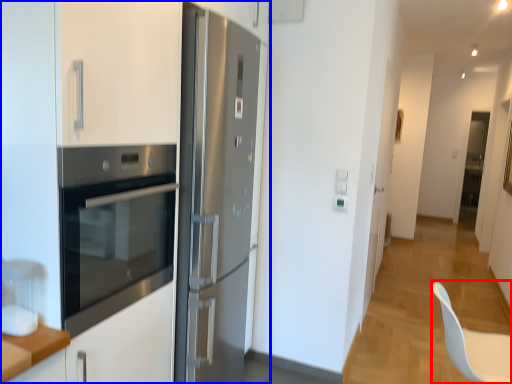
Question: Which point is further to the camera, swivel chair (highlighted by a red box) or cabinetry (highlighted by a blue box)?

Choices:
 (A) swivel chair
 (B) cabinetry

Answer: (A)